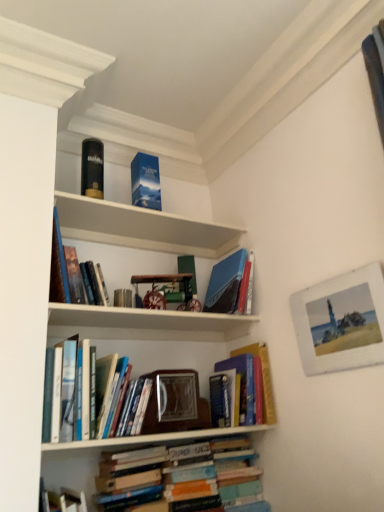
Question: From the image's perspective, would you say hardcover books at center, which is counted as the 2th book, starting from the top, is shown under hardcover book at center, which is the second book in bottom-to-top order?

Choices:
 (A) no
 (B) yes

Answer: (A)

Question: Is hardcover books at center, the third book from the bottom, aimed at hardcover book at center, which is the second book in bottom-to-top order?

Choices:
 (A) no
 (B) yes

Answer: (A)

Question: Is hardcover books at center, which is counted as the 2th book, starting from the top, further to the viewer compared to hardcover book at center, which is the second book in bottom-to-top order?

Choices:
 (A) no
 (B) yes

Answer: (A)

Question: Does hardcover books at center, which is counted as the 2th book, starting from the top, have a greater width compared to hardcover book at center, which is the second book in bottom-to-top order?

Choices:
 (A) no
 (B) yes

Answer: (A)

Question: Is hardcover books at center, which is counted as the 2th book, starting from the top, bigger than hardcover book at center, acting as the third book starting from the top?

Choices:
 (A) no
 (B) yes

Answer: (B)

Question: From the image's perspective, is blue cardboard box at upper center positioned above or below white wooden picture frame at upper right?

Choices:
 (A) below
 (B) above

Answer: (B)

Question: From a real-world perspective, is blue cardboard box at upper center positioned above or below white wooden picture frame at upper right?

Choices:
 (A) above
 (B) below

Answer: (A)

Question: Considering their positions, is blue cardboard box at upper center located in front of or behind white wooden picture frame at upper right?

Choices:
 (A) behind
 (B) front

Answer: (A)

Question: Considering the positions of blue cardboard box at upper center and white wooden picture frame at upper right in the image, is blue cardboard box at upper center taller or shorter than white wooden picture frame at upper right?

Choices:
 (A) tall
 (B) short

Answer: (B)

Question: From a real-world perspective, is hardcover book at upper left, positioned as the first book in top-to-bottom order, positioned above or below white wooden picture frame at upper right?

Choices:
 (A) below
 (B) above

Answer: (B)

Question: Based on their sizes in the image, would you say hardcover book at upper left, positioned as the first book in top-to-bottom order, is bigger or smaller than white wooden picture frame at upper right?

Choices:
 (A) small
 (B) big

Answer: (B)

Question: Is hardcover book at upper left, positioned as the first book in top-to-bottom order, wider or thinner than white wooden picture frame at upper right?

Choices:
 (A) wide
 (B) thin

Answer: (A)

Question: Is hardcover book at upper left, positioned as the first book in top-to-bottom order, inside the boundaries of white wooden picture frame at upper right, or outside?

Choices:
 (A) outside
 (B) inside

Answer: (A)

Question: Relative to blue cardboard box at upper center, is matte black book at upper left, which ranks as the second paperback book in right-to-left order, in front or behind?

Choices:
 (A) front
 (B) behind

Answer: (B)

Question: From the image's perspective, is matte black book at upper left, which ranks as the second paperback book in right-to-left order, above or below blue cardboard box at upper center?

Choices:
 (A) above
 (B) below

Answer: (A)